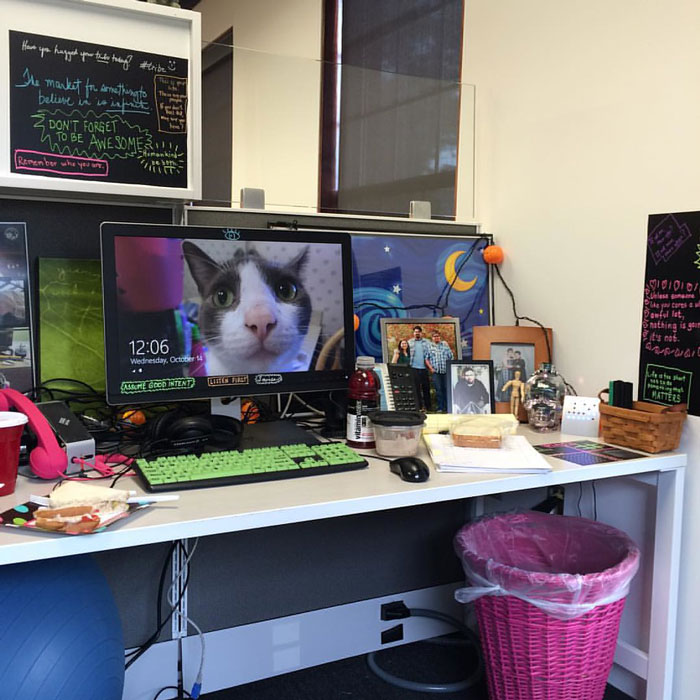
What are the coordinates of `wall` in the screenshot? It's located at (560, 201).